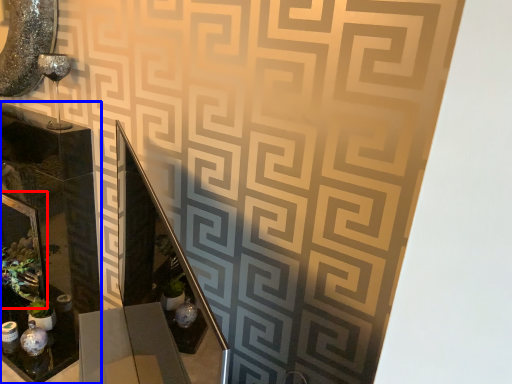
Question: Among these objects, which one is farthest to the camera, picture frame (highlighted by a red box) or glass box (highlighted by a blue box)?

Choices:
 (A) picture frame
 (B) glass box

Answer: (A)